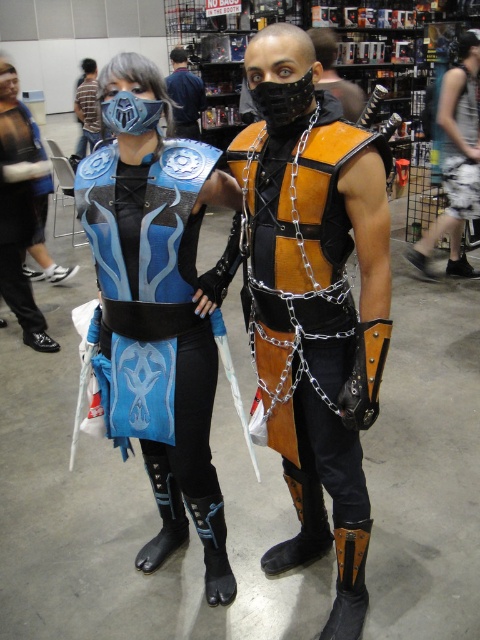
You are a photographer at the convention booth. You need to position the attendee with the denim shorts at lower right so that they are centered in the frame. Given their current position at point 0.252 on the x and 0.950 on the y coordinates, what direction should they move to be centered?

The denim shorts at lower right is currently at coordinates x 0.252 and y 0.950. To center them, they should move right to increase the x coordinate and up to decrease the y coordinate, as the center of the frame is at x 0.5 and y 0.5.

You are a photographer at the convention and need to ensure that both the matte blue fabric vest at center and the denim shorts at lower right are fully visible in a single frame. Based on their widths, can you fit both in the shot without cropping either?

The matte blue fabric vest at center might be wider than denim shorts at lower right, so there is a possibility that the vest could take up more space in the frame. To ensure both are fully visible, you should adjust your camera angle or position to accommodate the wider width of the matte blue fabric vest at center.